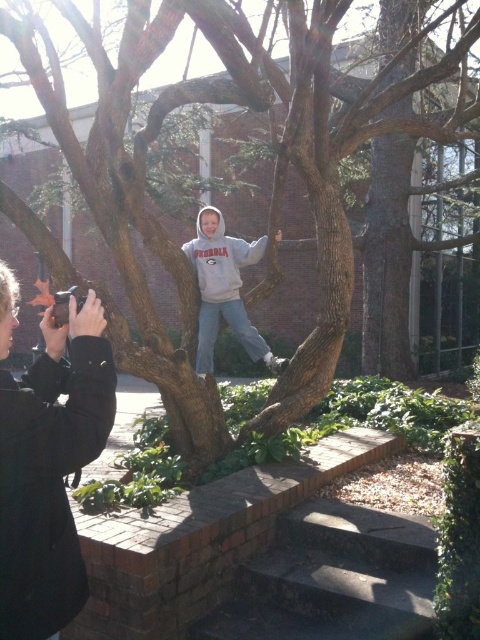
You are a photographer trying to set up a tripod to capture the child on the tree branch. The tripod requires a stable surface that is at least as tall as the gray fleece sweatshirt at center. Can you use the dark gray concrete stairs at lower center for this purpose?

The dark gray concrete stairs at lower center is shorter than the gray fleece sweatshirt at center, so it is not tall enough to provide a stable surface for the tripod that requires a height equal to or greater than the gray fleece sweatshirt at center.

You are organizing a photo shoot and need to place the black fabric camera at lower left and the gray fleece hoodie at center in your setup. Since you want to ensure the camera is not too big compared to the hoodie, does the current size of the camera meet your requirement?

Yes, the black fabric camera at lower left is smaller than the gray fleece hoodie at center, so it meets the requirement of not being too big compared to the hoodie.

You are standing at the point labeled as point (x=215, y=300) and want to take a photo of the point labeled as point (x=46, y=412). Is there any obstruction between you and the target point?

Point (x=46, y=412) is in front of point (x=215, y=300), so there is no obstruction between you and the target point.